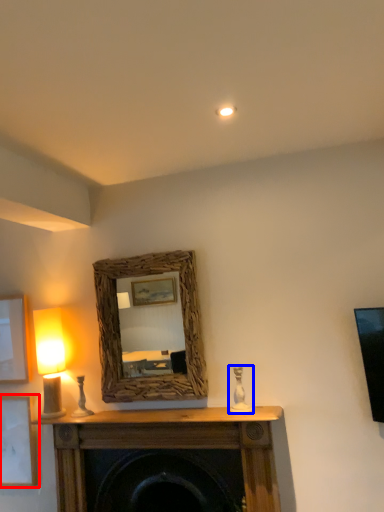
Question: Which of the following is the farthest to the observer, picture frame (highlighted by a red box) or candle holder (highlighted by a blue box)?

Choices:
 (A) picture frame
 (B) candle holder

Answer: (A)